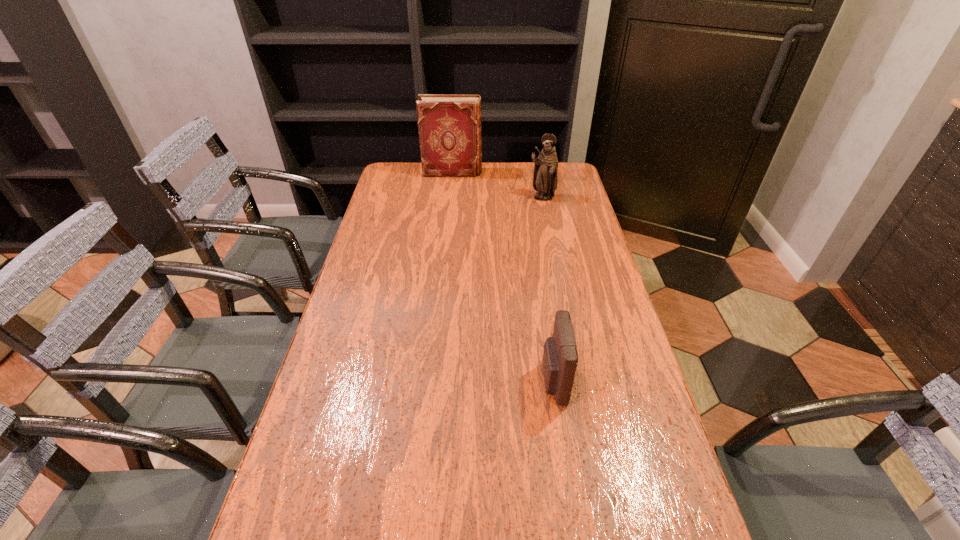
The height and width of the screenshot is (540, 960). Identify the location of vacant space that's between the shortest object and the leftmost object. (503, 277).

Find the location of a particular element. This screenshot has width=960, height=540. free spot between the second nearest object and the nearest object is located at coordinates (547, 290).

Image resolution: width=960 pixels, height=540 pixels. What are the coordinates of `free spot between the second tallest object and the nearest object` in the screenshot? It's located at (547, 290).

This screenshot has width=960, height=540. Find the location of `free space between the second shortest object and the leftmost object`. free space between the second shortest object and the leftmost object is located at coordinates (497, 185).

Identify the location of vacant space that is in between the figurine and the farthest object. (497, 185).

Select which object appears as the closest to the hardback book. Please provide its 2D coordinates. Your answer should be formatted as a tuple, i.e. [(x, y)], where the tuple contains the x and y coordinates of a point satisfying the conditions above.

[(545, 179)]

The image size is (960, 540). Identify the location of object that is the closest to the leftmost object. (545, 179).

Find the location of a particular element. This screenshot has width=960, height=540. free spot that satisfies the following two spatial constraints: 1. on the front-facing side of the second tallest object; 2. with an open flap on the pouch is located at coordinates (580, 382).

I want to click on vacant space that satisfies the following two spatial constraints: 1. on the front-facing side of the second tallest object; 2. with an open flap on the shortest object, so click(x=580, y=382).